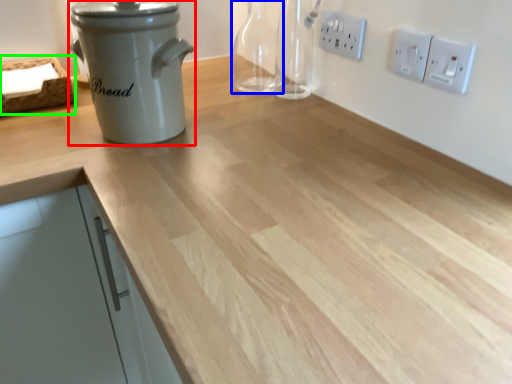
Question: Estimate the real-world distances between objects in this image. Which object is closer to kitchen appliance (highlighted by a red box), bottle (highlighted by a blue box) or basket (highlighted by a green box)?

Choices:
 (A) bottle
 (B) basket

Answer: (B)